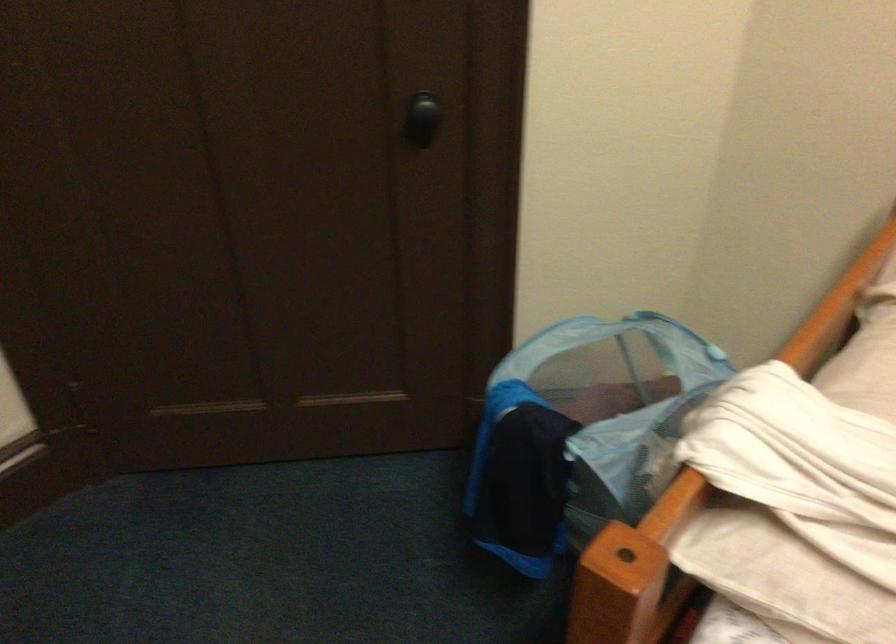
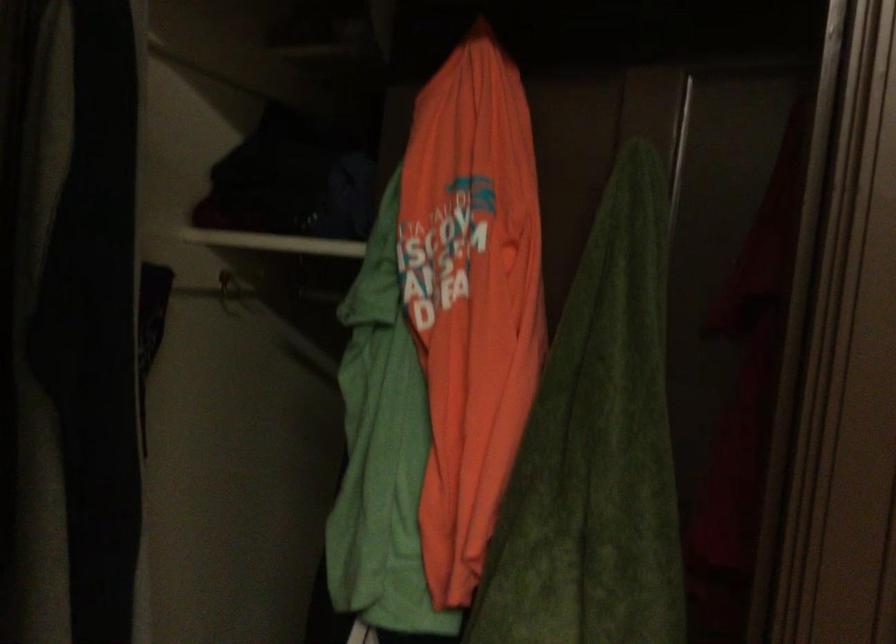
Question: Based on the continuous images, in which direction is the camera rotating? Reply with the corresponding letter.

Choices:
 (A) Left
 (B) Right
 (C) Up
 (D) Down

Answer: (A)